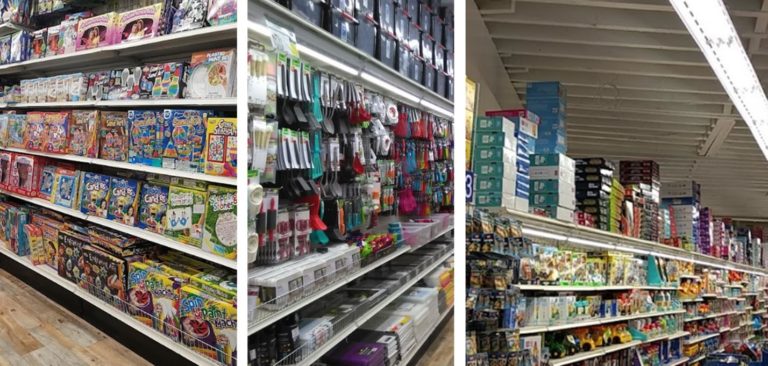
Image resolution: width=768 pixels, height=366 pixels. In order to click on the bottom shelves in this screenshot , I will do `click(399, 326)`.